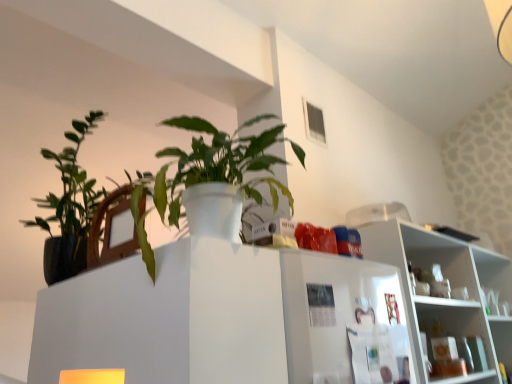
The height and width of the screenshot is (384, 512). I want to click on white glossy shelf at upper right, so click(x=451, y=287).

What do you see at coordinates (451, 287) in the screenshot? I see `white glossy shelf at upper right` at bounding box center [451, 287].

Find the location of a particular element. This screenshot has height=384, width=512. green matte plant at upper left is located at coordinates coord(69,204).

Describe the element at coordinates (69, 204) in the screenshot. Image resolution: width=512 pixels, height=384 pixels. I see `green matte plant at upper left` at that location.

This screenshot has height=384, width=512. I want to click on white glossy shelf at upper right, so click(451, 287).

Is white glossy shelf at upper right to the left of green matte plant at upper left from the viewer's perspective?

No, white glossy shelf at upper right is not to the left of green matte plant at upper left.

Which is behind, white glossy shelf at upper right or green matte plant at upper left?

white glossy shelf at upper right.

Is point (395, 244) positioned behind point (70, 170)?

Yes, it is.

From the image's perspective, is white glossy shelf at upper right above or below green matte plant at upper left?

Based on their image positions, white glossy shelf at upper right is located beneath green matte plant at upper left.

From a real-world perspective, is white glossy shelf at upper right positioned above or below green matte plant at upper left?

In terms of real-world spatial position, white glossy shelf at upper right is below green matte plant at upper left.

Looking at this image, does white glossy shelf at upper right have a lesser width compared to green matte plant at upper left?

Yes, white glossy shelf at upper right is thinner than green matte plant at upper left.

From their relative heights in the image, would you say white glossy shelf at upper right is taller or shorter than green matte plant at upper left?

Considering their sizes, white glossy shelf at upper right has more height than green matte plant at upper left.

Considering the sizes of objects white glossy shelf at upper right and green matte plant at upper left in the image provided, who is bigger, white glossy shelf at upper right or green matte plant at upper left?

With larger size is white glossy shelf at upper right.

Could green matte plant at upper left be considered to be inside white glossy shelf at upper right?

That's incorrect, green matte plant at upper left is not inside white glossy shelf at upper right.

Consider the image. Is white glossy shelf at upper right next to green matte plant at upper left?

No, white glossy shelf at upper right is not beside green matte plant at upper left.

Is white glossy shelf at upper right turned away from green matte plant at upper left?

white glossy shelf at upper right does not have its back to green matte plant at upper left.

Measure the distance from white glossy shelf at upper right to green matte plant at upper left.

They are 1.38 meters apart.

Where is `shelf lying below the green matte plant at upper left (from the image's perspective)`? shelf lying below the green matte plant at upper left (from the image's perspective) is located at coordinates (451, 287).

Is green matte plant at upper left to the right of white glossy shelf at upper right from the viewer's perspective?

Incorrect, green matte plant at upper left is not on the right side of white glossy shelf at upper right.

Is the position of green matte plant at upper left more distant than that of white glossy shelf at upper right?

No, the depth of green matte plant at upper left is less than that of white glossy shelf at upper right.

Does point (92, 184) lie behind point (435, 311)?

That is True.

From the image's perspective, is green matte plant at upper left located above or below white glossy shelf at upper right?

Based on their image positions, green matte plant at upper left is located above white glossy shelf at upper right.

From a real-world perspective, between green matte plant at upper left and white glossy shelf at upper right, who is vertically lower?

From a 3D spatial view, white glossy shelf at upper right is below.

Which object is wider, green matte plant at upper left or white glossy shelf at upper right?

green matte plant at upper left is wider.

Which of these two, green matte plant at upper left or white glossy shelf at upper right, stands shorter?

green matte plant at upper left.

Based on their sizes in the image, would you say green matte plant at upper left is bigger or smaller than white glossy shelf at upper right?

Considering their sizes, green matte plant at upper left takes up less space than white glossy shelf at upper right.

Based on the photo, is green matte plant at upper left inside the boundaries of white glossy shelf at upper right, or outside?

green matte plant at upper left exists outside the volume of white glossy shelf at upper right.

Can you see green matte plant at upper left touching white glossy shelf at upper right?

green matte plant at upper left and white glossy shelf at upper right are not in contact.

Is green matte plant at upper left aimed at white glossy shelf at upper right?

No, green matte plant at upper left is not aimed at white glossy shelf at upper right.

Where is `houseplant on the left of the white glossy shelf at upper right`? This screenshot has height=384, width=512. houseplant on the left of the white glossy shelf at upper right is located at coordinates (69, 204).

The image size is (512, 384). I want to click on houseplant in front of the white glossy shelf at upper right, so click(69, 204).

The height and width of the screenshot is (384, 512). Identify the location of shelf that appears on the right of green matte plant at upper left. (451, 287).